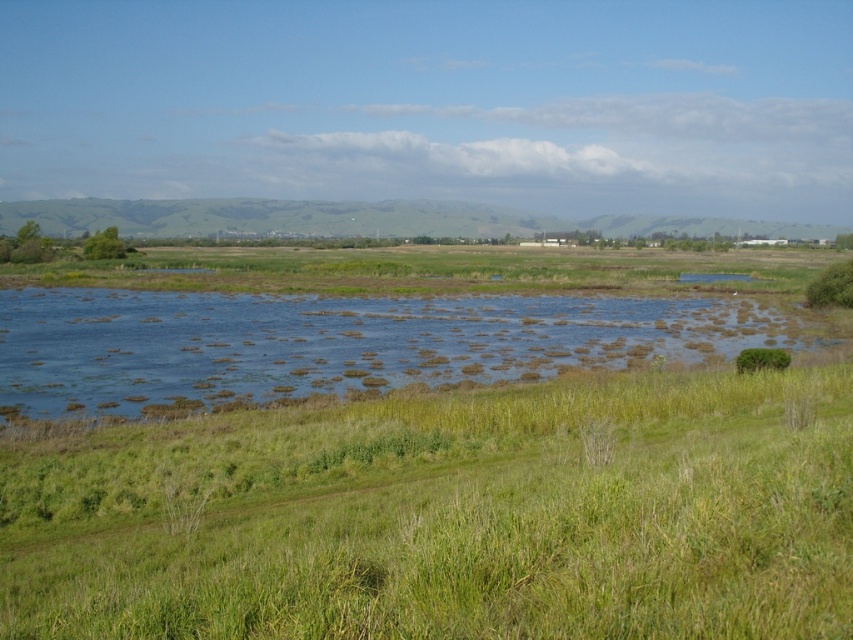
From the picture: Between green grassy at lower left and blue grassy river at center, which one has more height?

Standing taller between the two is blue grassy river at center.

Which is in front, point (793, 490) or point (210, 372)?

Point (793, 490) is in front.

Locate an element on the screen. Image resolution: width=853 pixels, height=640 pixels. green grassy at lower left is located at coordinates (448, 515).